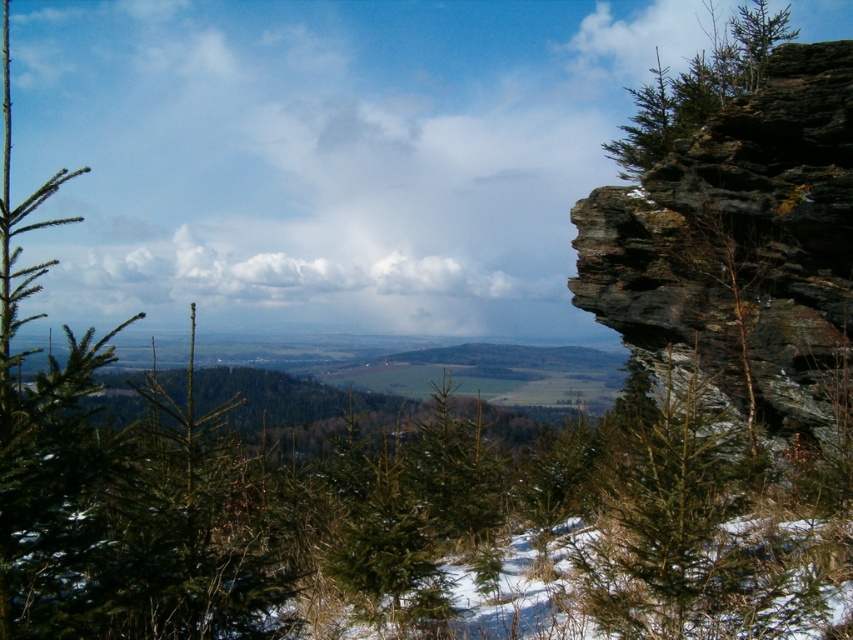
In the scene shown: You are a hiker planning to traverse between the two green matte trees mentioned. Given that your average walking pace is 3 miles per hour, how long would it take you to walk directly between the green matte tree at right and the green matte tree at upper right?

The distance between the green matte tree at right and the green matte tree at upper right is 165.35 feet. Converting this to miles, 165.35 feet is approximately 0.0313 miles. At a walking pace of 3 miles per hour, it would take roughly 0.0313 divided by 3 equals approximately 0.0104 hours, which is about 0.624 minutes or roughly 37 seconds. Therefore, it would take approximately 37 seconds to walk directly between the two trees.

You are a hiker trying to navigate through the snowy landscape. You see a green matte tree at right and a green matte tree at upper right. Which tree is closer to the ground?

The green matte tree at right is closer to the ground because it is positioned below the green matte tree at upper right.